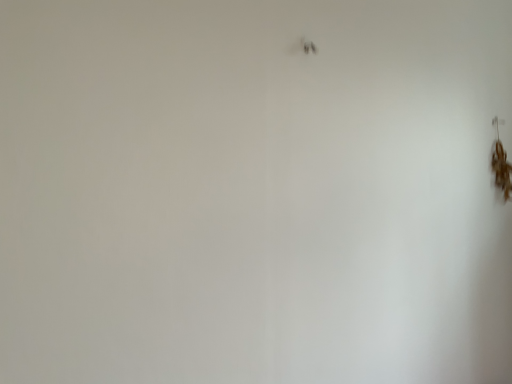
I want to click on brown fuzzy spider at lower right, so click(501, 169).

What do you see at coordinates (501, 169) in the screenshot? This screenshot has height=384, width=512. I see `brown fuzzy spider at lower right` at bounding box center [501, 169].

Where is `brown fuzzy spider at lower right`? This screenshot has width=512, height=384. brown fuzzy spider at lower right is located at coordinates (501, 169).